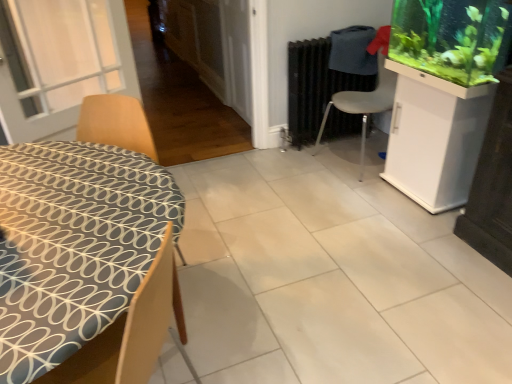
Question: Does wooden chair at left, the first chair positioned from the front, contain green matte aquarium at upper right?

Choices:
 (A) yes
 (B) no

Answer: (B)

Question: Considering the relative sizes of wooden chair at left, the first chair positioned from the front, and green matte aquarium at upper right in the image provided, is wooden chair at left, the first chair positioned from the front, shorter than green matte aquarium at upper right?

Choices:
 (A) no
 (B) yes

Answer: (A)

Question: Is wooden chair at left, positioned as the 1th chair in left-to-right order, next to green matte aquarium at upper right?

Choices:
 (A) yes
 (B) no

Answer: (B)

Question: Is wooden chair at left, positioned as the 1th chair in left-to-right order, wider than green matte aquarium at upper right?

Choices:
 (A) no
 (B) yes

Answer: (B)

Question: Considering the relative sizes of wooden chair at left, the first chair positioned from the front, and green matte aquarium at upper right in the image provided, is wooden chair at left, the first chair positioned from the front, smaller than green matte aquarium at upper right?

Choices:
 (A) no
 (B) yes

Answer: (A)

Question: Does wooden chair at left, positioned as the 1th chair in left-to-right order, appear on the left side of green matte aquarium at upper right?

Choices:
 (A) no
 (B) yes

Answer: (B)

Question: Is white plastic chair at center-right, the 1th chair viewed from the back, bigger than black matte radiator at center?

Choices:
 (A) yes
 (B) no

Answer: (A)

Question: Is white plastic chair at center-right, the 1th chair viewed from the back, positioned beyond the bounds of black matte radiator at center?

Choices:
 (A) no
 (B) yes

Answer: (B)

Question: From the image's perspective, does white plastic chair at center-right, the 1th chair viewed from the back, appear higher than black matte radiator at center?

Choices:
 (A) no
 (B) yes

Answer: (A)

Question: From a real-world perspective, is white plastic chair at center-right, the first chair viewed from the right, located beneath black matte radiator at center?

Choices:
 (A) yes
 (B) no

Answer: (B)

Question: Does white plastic chair at center-right, the first chair viewed from the right, have a greater height compared to black matte radiator at center?

Choices:
 (A) no
 (B) yes

Answer: (B)

Question: Can you confirm if white plastic chair at center-right, placed as the second chair when sorted from left to right, is positioned to the right of black matte radiator at center?

Choices:
 (A) yes
 (B) no

Answer: (A)

Question: Would you say black matte radiator at center is outside green matte aquarium at upper right?

Choices:
 (A) yes
 (B) no

Answer: (A)